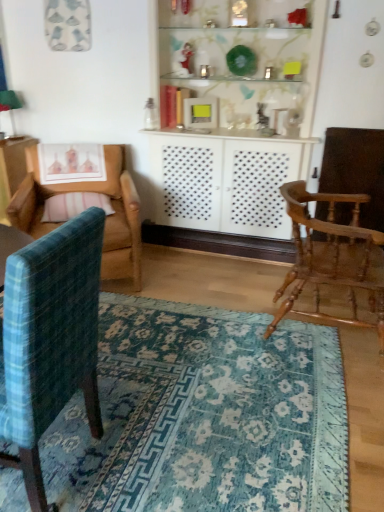
Question: Should I look upward or downward to see pink striped pillow at left?

Choices:
 (A) up
 (B) down

Answer: (A)

Question: Does teal plaid chair at left, placed as the 2th chair when sorted from left to right, have a greater width compared to pink striped pillow at left?

Choices:
 (A) yes
 (B) no

Answer: (A)

Question: From the image's perspective, does teal plaid chair at left, which is the second chair in right-to-left order, appear higher than pink striped pillow at left?

Choices:
 (A) no
 (B) yes

Answer: (A)

Question: Is teal plaid chair at left, placed as the 2th chair when sorted from left to right, aimed at pink striped pillow at left?

Choices:
 (A) yes
 (B) no

Answer: (B)

Question: Is teal plaid chair at left, placed as the 2th chair when sorted from left to right, closer to the viewer compared to pink striped pillow at left?

Choices:
 (A) no
 (B) yes

Answer: (B)

Question: Can we say teal plaid chair at left, placed as the 2th chair when sorted from left to right, lies outside pink striped pillow at left?

Choices:
 (A) no
 (B) yes

Answer: (B)

Question: Is teal plaid chair at left, which is the second chair in right-to-left order, at the right side of pink striped pillow at left?

Choices:
 (A) yes
 (B) no

Answer: (A)

Question: Considering the relative sizes of teal plaid chair at left, placed as the 2th chair when sorted from left to right, and blue woven rug at lower center in the image provided, is teal plaid chair at left, placed as the 2th chair when sorted from left to right, smaller than blue woven rug at lower center?

Choices:
 (A) yes
 (B) no

Answer: (B)

Question: From a real-world perspective, is teal plaid chair at left, placed as the 2th chair when sorted from left to right, positioned under blue woven rug at lower center based on gravity?

Choices:
 (A) yes
 (B) no

Answer: (B)

Question: Is the depth of teal plaid chair at left, placed as the 2th chair when sorted from left to right, greater than that of blue woven rug at lower center?

Choices:
 (A) no
 (B) yes

Answer: (A)

Question: Is teal plaid chair at left, which is the second chair in right-to-left order, touching blue woven rug at lower center?

Choices:
 (A) yes
 (B) no

Answer: (B)

Question: Can you confirm if teal plaid chair at left, placed as the 2th chair when sorted from left to right, is wider than blue woven rug at lower center?

Choices:
 (A) no
 (B) yes

Answer: (A)

Question: Is teal plaid chair at left, which is the second chair in right-to-left order, thinner than blue woven rug at lower center?

Choices:
 (A) yes
 (B) no

Answer: (A)

Question: From a real-world perspective, is wooden rocking chair at right, placed as the third chair when sorted from left to right, positioned over blue woven rug at lower center based on gravity?

Choices:
 (A) yes
 (B) no

Answer: (A)